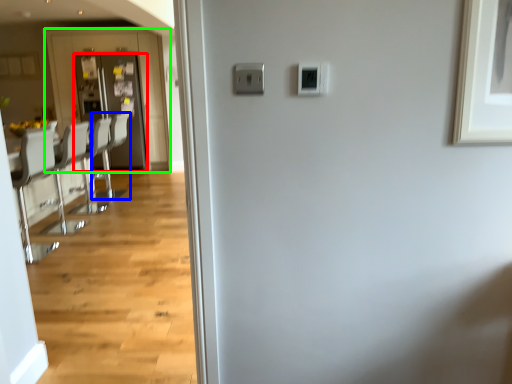
Question: Estimate the real-world distances between objects in this image. Which object is closer to door (highlighted by a red box), armchair (highlighted by a blue box) or screen door (highlighted by a green box)?

Choices:
 (A) armchair
 (B) screen door

Answer: (B)